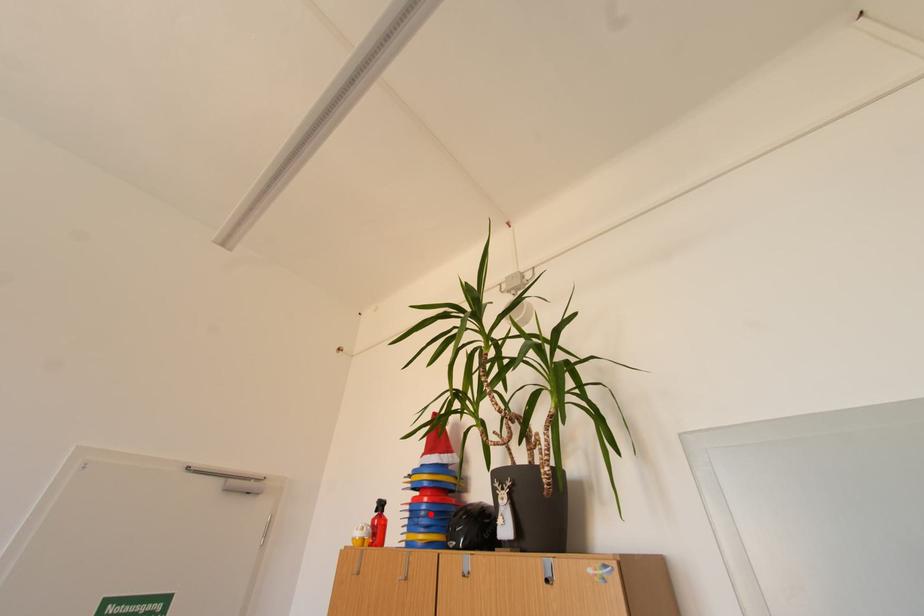
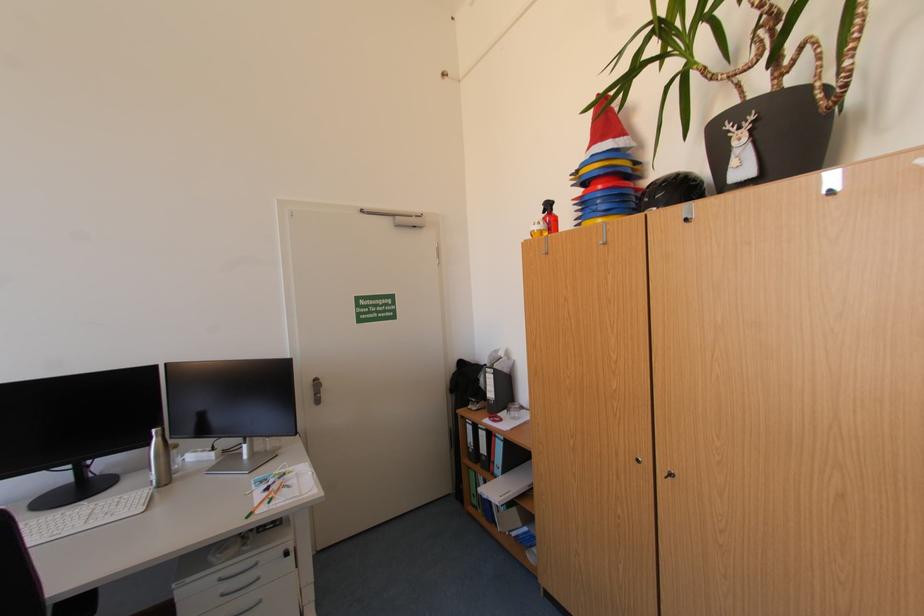
In the second image, find the point that corresponds to the highlighted location in the first image.

(606, 203)